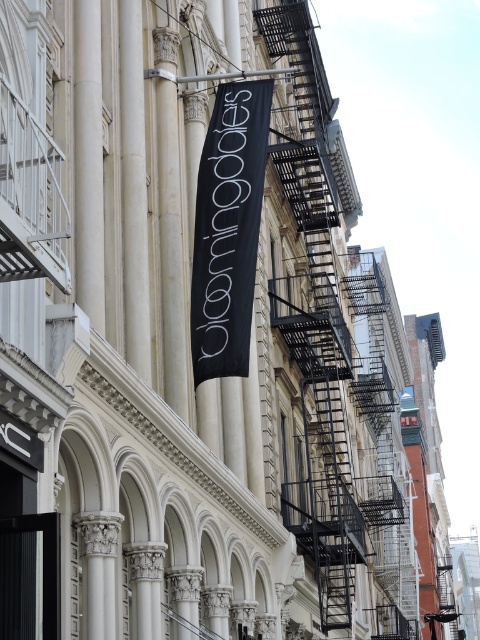
Which is more to the left, black metal fire escape at upper right or black fabric banner at center?

From the viewer's perspective, black fabric banner at center appears more on the left side.

Identify the location of black metal fire escape at upper right. (300, 396).